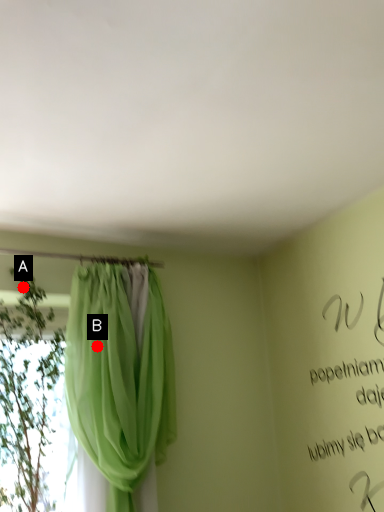
Question: Two points are circled on the image, labeled by A and B beside each circle. Which of the following is the farthest from the observer?

Choices:
 (A) A is further
 (B) B is further

Answer: (A)